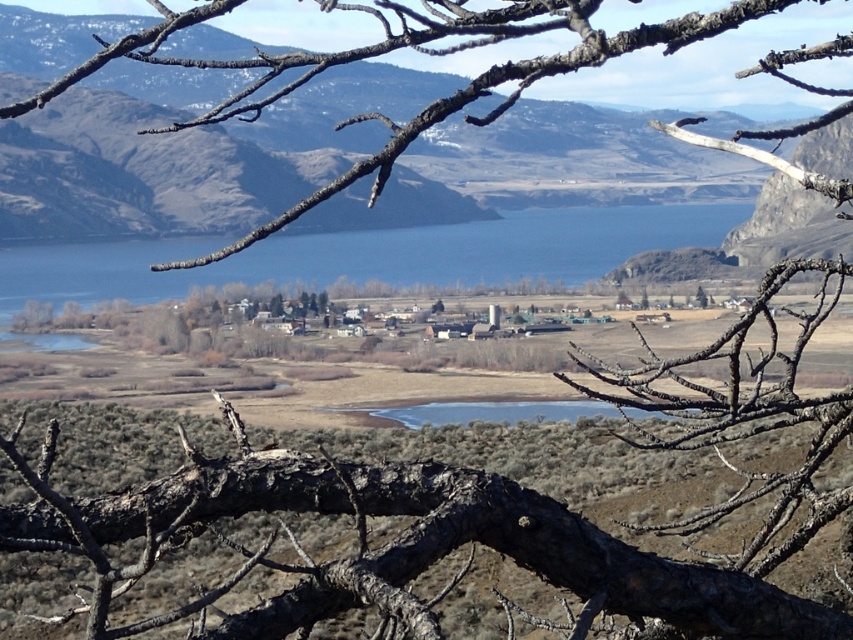
Which is behind, point (209, 12) or point (490, 419)?

Point (490, 419)

Looking at this image, how much distance is there between brown rough branch at upper center and clear water at center?

They are 7.92 meters apart.

The width and height of the screenshot is (853, 640). Describe the element at coordinates (395, 51) in the screenshot. I see `brown rough branch at upper center` at that location.

Locate an element on the screen. This screenshot has height=640, width=853. brown rough branch at upper center is located at coordinates (395, 51).

Does dark brown bark at center have a smaller size compared to brown rough branch at upper center?

Indeed, dark brown bark at center has a smaller size compared to brown rough branch at upper center.

What do you see at coordinates (399, 541) in the screenshot? I see `dark brown bark at center` at bounding box center [399, 541].

Who is more forward, (38,512) or (222,68)?

Point (38,512) is in front.

Where is `dark brown bark at center`? Image resolution: width=853 pixels, height=640 pixels. dark brown bark at center is located at coordinates (399, 541).

Who is higher up, brown rough branch at upper center or blue water at center?

Positioned higher is brown rough branch at upper center.

Does brown rough branch at upper center have a larger size compared to blue water at center?

Indeed, brown rough branch at upper center has a larger size compared to blue water at center.

Does point (755, 72) lie in front of point (372, 248)?

Yes, it is in front of point (372, 248).

Where is `brown rough branch at upper center`? The height and width of the screenshot is (640, 853). brown rough branch at upper center is located at coordinates (395, 51).